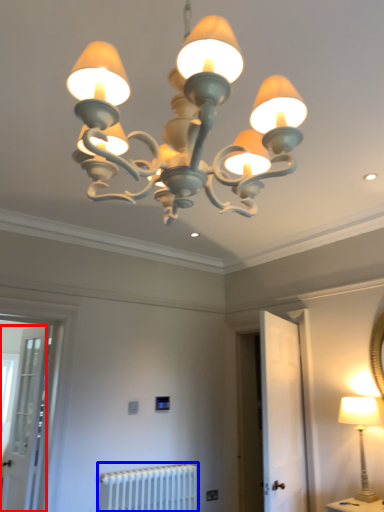
Question: Which object appears farthest to the camera in this image, screen door (highlighted by a red box) or radiator (highlighted by a blue box)?

Choices:
 (A) screen door
 (B) radiator

Answer: (A)